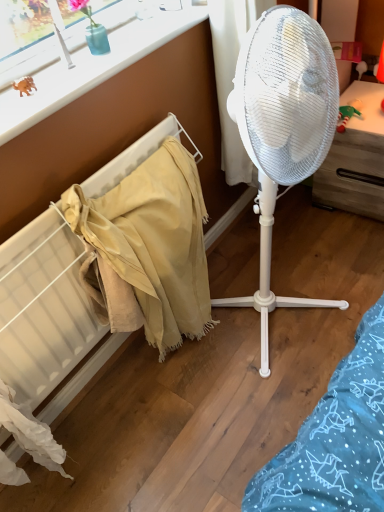
Find the location of a particular element. The width and height of the screenshot is (384, 512). vacant area that is in front of white plastic fan at center is located at coordinates (258, 410).